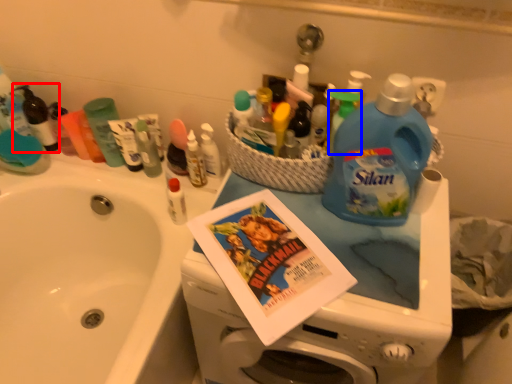
Question: Which object appears farthest to the camera in this image, toiletry (highlighted by a red box) or cleaning product (highlighted by a blue box)?

Choices:
 (A) toiletry
 (B) cleaning product

Answer: (A)